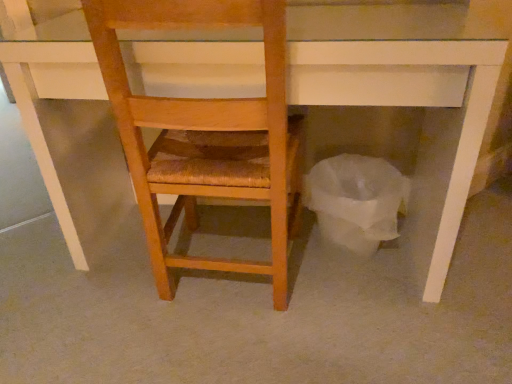
Locate an element on the screen. Image resolution: width=512 pixels, height=384 pixels. free location in front of white paper bag at lower right is located at coordinates point(367,309).